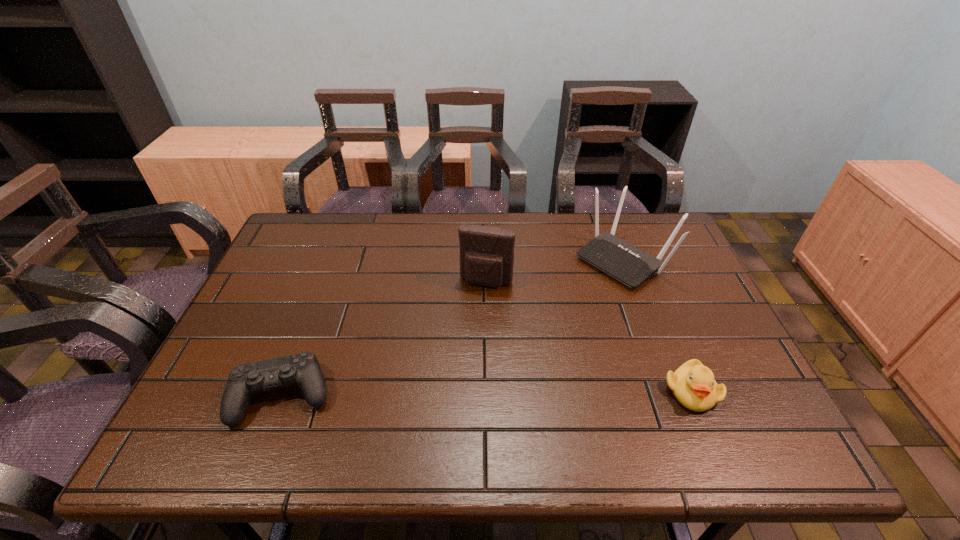
Where is `vacant space that satisfies the following two spatial constraints: 1. on the back side of the router; 2. on the left side of the control`? The width and height of the screenshot is (960, 540). vacant space that satisfies the following two spatial constraints: 1. on the back side of the router; 2. on the left side of the control is located at coordinates (335, 259).